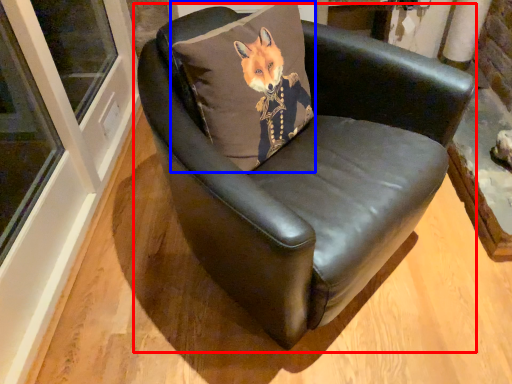
Question: Which object is further to the camera taking this photo, chair (highlighted by a red box) or pillow (highlighted by a blue box)?

Choices:
 (A) chair
 (B) pillow

Answer: (B)